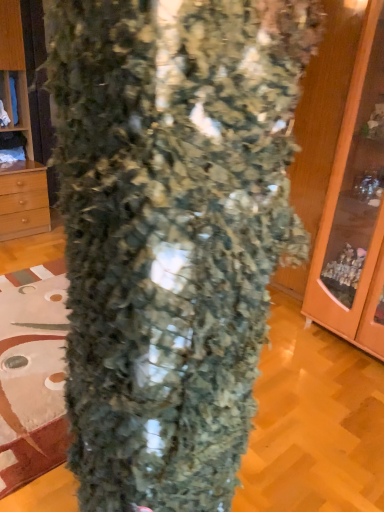
Measure the distance between point [0,219] and camera.

Point [0,219] is 3.31 meters away from camera.

This screenshot has width=384, height=512. What do you see at coordinates (24, 120) in the screenshot?
I see `wooden cabinet at left` at bounding box center [24, 120].

I want to click on wooden cabinet at left, so click(x=24, y=120).

What are the coordinates of `wooden cabinet at left` in the screenshot? It's located at (24, 120).